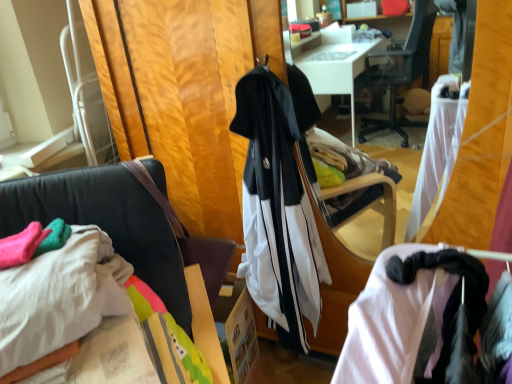
Question: Is white cotton sheet at lower left bigger than white matte tracksuit at center?

Choices:
 (A) no
 (B) yes

Answer: (A)

Question: Is white cotton sheet at lower left far away from white matte tracksuit at center?

Choices:
 (A) yes
 (B) no

Answer: (B)

Question: Is white cotton sheet at lower left thinner than white matte tracksuit at center?

Choices:
 (A) yes
 (B) no

Answer: (B)

Question: Is white cotton sheet at lower left to the right of white matte tracksuit at center from the viewer's perspective?

Choices:
 (A) yes
 (B) no

Answer: (B)

Question: Does white cotton sheet at lower left have a greater width compared to white matte tracksuit at center?

Choices:
 (A) no
 (B) yes

Answer: (B)

Question: Is the position of white cotton sheet at lower left more distant than that of white matte tracksuit at center?

Choices:
 (A) yes
 (B) no

Answer: (B)

Question: Does white matte tracksuit at center turn towards white cotton sheet at lower left?

Choices:
 (A) yes
 (B) no

Answer: (B)

Question: From a real-world perspective, is white matte tracksuit at center below white cotton sheet at lower left?

Choices:
 (A) yes
 (B) no

Answer: (A)

Question: Can you confirm if white matte tracksuit at center is shorter than white cotton sheet at lower left?

Choices:
 (A) no
 (B) yes

Answer: (A)

Question: Can you confirm if white matte tracksuit at center is thinner than white cotton sheet at lower left?

Choices:
 (A) no
 (B) yes

Answer: (B)

Question: Does white matte tracksuit at center lie in front of white cotton sheet at lower left?

Choices:
 (A) yes
 (B) no

Answer: (B)

Question: Is white matte tracksuit at center wider than white cotton sheet at lower left?

Choices:
 (A) yes
 (B) no

Answer: (B)

Question: Is white cotton sheet at lower left at the right side of velvet black chair at center?

Choices:
 (A) no
 (B) yes

Answer: (A)